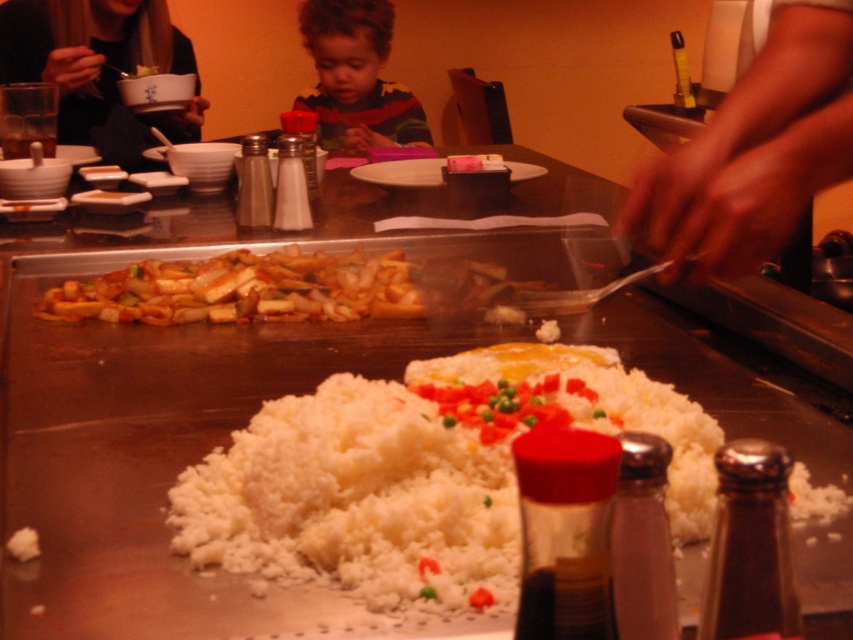
You are a customer sitting at the teppanyaki table and want to grab the soy sauce bottle located at the center. However, you notice two objects in your view. Which object is closer to you between the smooth skin hands at center right and the blonde hair at upper left?

The smooth skin hands at center right is positioned under blonde hair at upper left, so the smooth skin hands at center right is closer to you.

Consider the image. You are a customer sitting at the teppanyaki table and want to reach for the condiments. There are two points on the table labeled as point (355, 132) and point (412, 173). Which point is closer to you?

Point (412, 173) is closer to you because point (355, 132) is behind it.